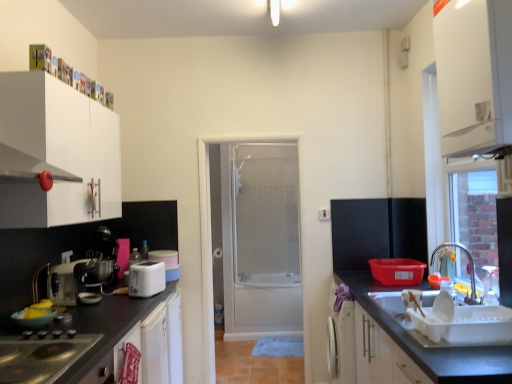
Question: Does white plastic toaster at center, which is the 3th appliance from front to back, appear on the right side of metallic silver mixer at left, which is counted as the 3th appliance, starting from the back?

Choices:
 (A) yes
 (B) no

Answer: (A)

Question: From a real-world perspective, is white plastic toaster at center, which is the 3th appliance from front to back, located beneath metallic silver mixer at left, which is counted as the 3th appliance, starting from the back?

Choices:
 (A) yes
 (B) no

Answer: (A)

Question: From the image's perspective, is white plastic toaster at center, which is the first appliance in back-to-front order, beneath metallic silver mixer at left, the 1th appliance from the front?

Choices:
 (A) no
 (B) yes

Answer: (B)

Question: Can you confirm if white plastic toaster at center, which is the first appliance in back-to-front order, is taller than metallic silver mixer at left, the 1th appliance from the front?

Choices:
 (A) no
 (B) yes

Answer: (A)

Question: Could you tell me if white plastic toaster at center, which is the 3th appliance from front to back, is turned towards metallic silver mixer at left, which is counted as the 3th appliance, starting from the back?

Choices:
 (A) no
 (B) yes

Answer: (A)

Question: Is white plastic toaster at center, which is the 3th appliance from front to back, at the left side of metallic silver mixer at left, the 1th appliance from the front?

Choices:
 (A) no
 (B) yes

Answer: (A)

Question: Is metallic silver coffee machine at left further to the viewer compared to black glass gas stove at lower left?

Choices:
 (A) no
 (B) yes

Answer: (B)

Question: Is metallic silver coffee machine at left smaller than black glass gas stove at lower left?

Choices:
 (A) yes
 (B) no

Answer: (B)

Question: Is metallic silver coffee machine at left not within black glass gas stove at lower left?

Choices:
 (A) yes
 (B) no

Answer: (A)

Question: Is metallic silver coffee machine at left turned away from black glass gas stove at lower left?

Choices:
 (A) yes
 (B) no

Answer: (B)

Question: Does metallic silver coffee machine at left have a lesser height compared to black glass gas stove at lower left?

Choices:
 (A) no
 (B) yes

Answer: (A)

Question: From a real-world perspective, is metallic silver coffee machine at left physically above black glass gas stove at lower left?

Choices:
 (A) yes
 (B) no

Answer: (A)

Question: From the image's perspective, is black glass gas stove at lower left located beneath metallic silver mixer at left, which is counted as the 3th appliance, starting from the back?

Choices:
 (A) yes
 (B) no

Answer: (A)